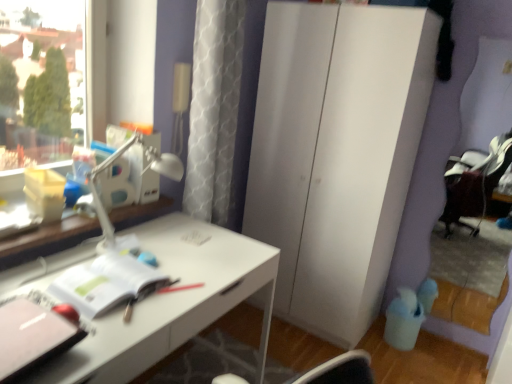
Question: Considering the relative positions of white plastic table lamp at upper left and white glossy desk at center in the image provided, is white plastic table lamp at upper left to the right of white glossy desk at center from the viewer's perspective?

Choices:
 (A) yes
 (B) no

Answer: (A)

Question: Is white plastic table lamp at upper left in front of white glossy desk at center?

Choices:
 (A) yes
 (B) no

Answer: (B)

Question: Does white plastic table lamp at upper left touch white glossy desk at center?

Choices:
 (A) yes
 (B) no

Answer: (B)

Question: From a real-world perspective, does white plastic table lamp at upper left sit lower than white glossy desk at center?

Choices:
 (A) no
 (B) yes

Answer: (A)

Question: Does white plastic table lamp at upper left have a lesser width compared to white glossy desk at center?

Choices:
 (A) no
 (B) yes

Answer: (B)

Question: Is white plastic table lamp at upper left wider than white glossy desk at center?

Choices:
 (A) no
 (B) yes

Answer: (A)

Question: Is white matte notebook at center, which is counted as the second notebook, starting from the front, taller than pink matte notebook at lower left, the 1th notebook in the front-to-back sequence?

Choices:
 (A) yes
 (B) no

Answer: (B)

Question: Is white matte notebook at center, which is counted as the second notebook, starting from the front, far from pink matte notebook at lower left, the 1th notebook in the front-to-back sequence?

Choices:
 (A) no
 (B) yes

Answer: (A)

Question: Would you say white matte notebook at center, the 1th notebook when ordered from back to front, is outside pink matte notebook at lower left, the 1th notebook in the front-to-back sequence?

Choices:
 (A) yes
 (B) no

Answer: (A)

Question: Can you confirm if white matte notebook at center, the 1th notebook when ordered from back to front, is wider than pink matte notebook at lower left, the 1th notebook in the front-to-back sequence?

Choices:
 (A) yes
 (B) no

Answer: (B)

Question: Considering the relative sizes of white matte notebook at center, the 1th notebook when ordered from back to front, and pink matte notebook at lower left, marked as the 2th notebook in a back-to-front arrangement, in the image provided, is white matte notebook at center, the 1th notebook when ordered from back to front, shorter than pink matte notebook at lower left, marked as the 2th notebook in a back-to-front arrangement,?

Choices:
 (A) yes
 (B) no

Answer: (A)

Question: Is white matte notebook at center, which is counted as the second notebook, starting from the front, next to pink matte notebook at lower left, the 1th notebook in the front-to-back sequence?

Choices:
 (A) yes
 (B) no

Answer: (B)

Question: Is pink matte notebook at lower left, marked as the 2th notebook in a back-to-front arrangement, oriented away from white matte notebook at center, which is counted as the second notebook, starting from the front?

Choices:
 (A) no
 (B) yes

Answer: (A)